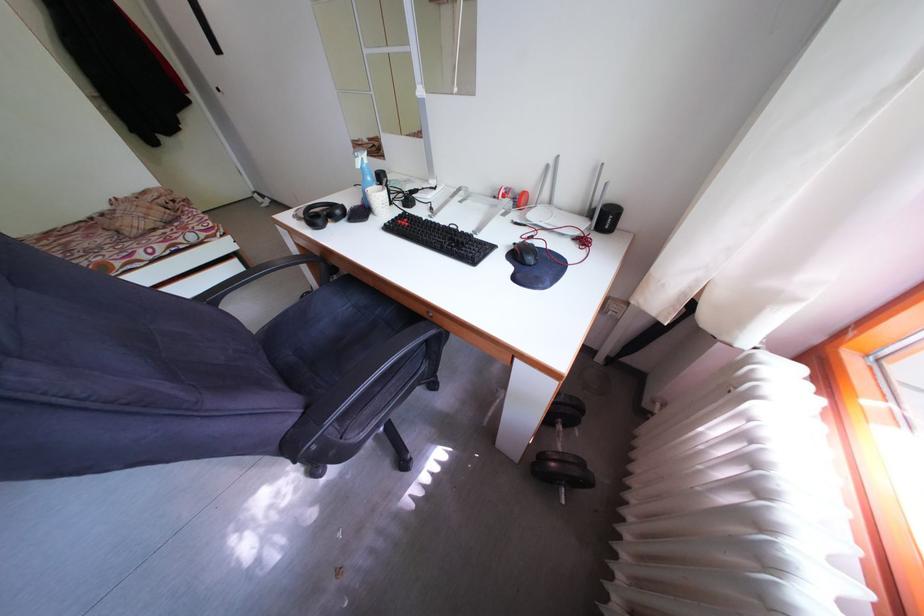
Identify the location of white router antenna. (553, 180).